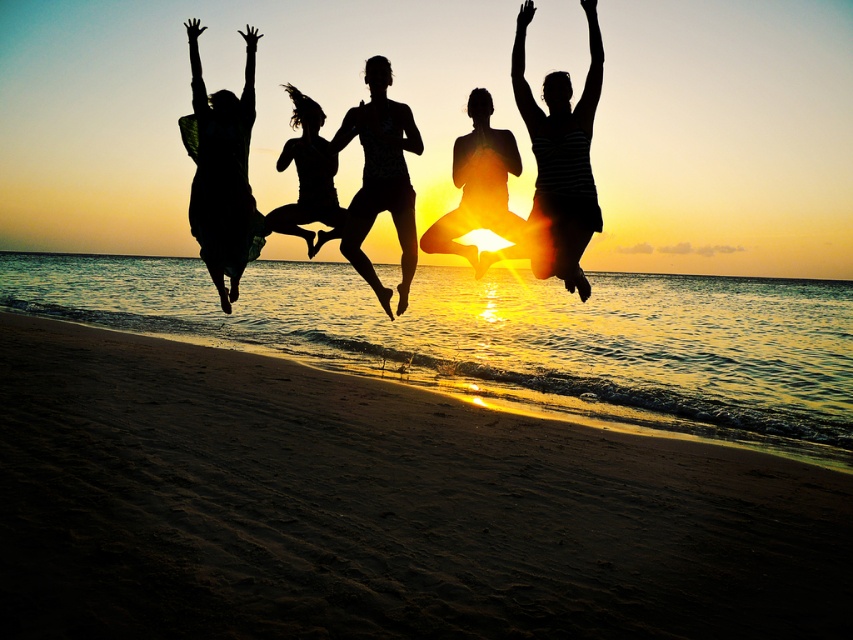
You are a photographer taking a sunset beach photo. In the image, there are two people of interest, the striped fabric person at upper right and the silhouette yoga pose at center. Which one is positioned higher in the frame?

The striped fabric person at upper right is positioned higher in the frame than the silhouette yoga pose at center.